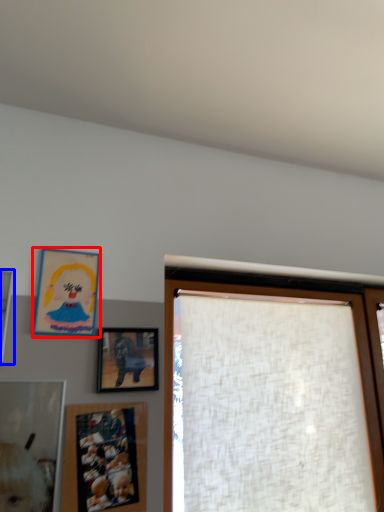
Question: Which object is further to the camera taking this photo, picture frame (highlighted by a red box) or picture frame (highlighted by a blue box)?

Choices:
 (A) picture frame
 (B) picture frame

Answer: (A)